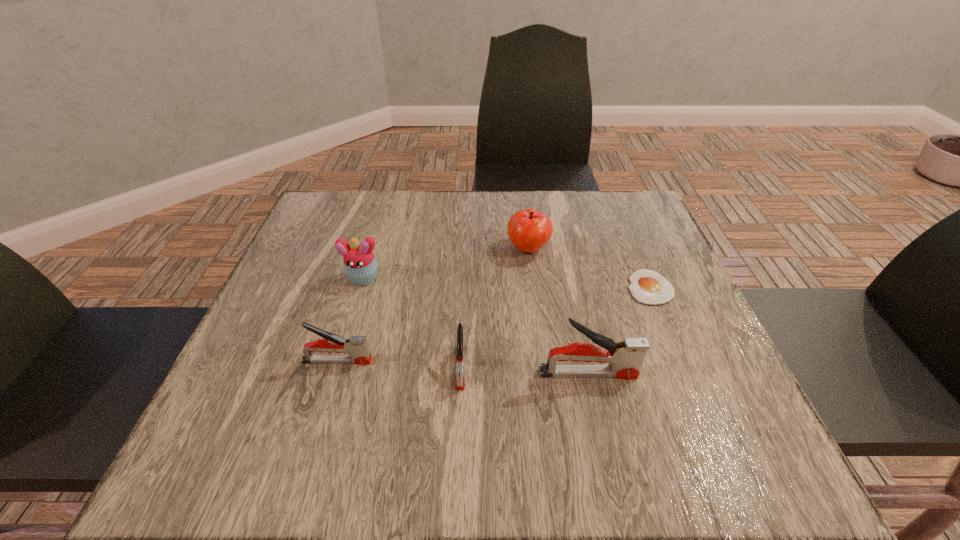
Where is `the leftmost stapler`? the leftmost stapler is located at coordinates pos(357,347).

Where is `the fourth object from right to left`? The image size is (960, 540). the fourth object from right to left is located at coordinates (460, 381).

Find the location of a particular element. the second stapler from right to left is located at coordinates pyautogui.click(x=460, y=381).

In order to click on the rightmost stapler in this screenshot , I will do `click(626, 356)`.

You are a GUI agent. You are given a task and a screenshot of the screen. Output one action in this format:
    pyautogui.click(x=<x>, y=<y>)
    Task: Click on the tallest stapler
    This screenshot has width=960, height=540.
    Given the screenshot: What is the action you would take?
    pyautogui.click(x=626, y=356)

At what (x,y) coordinates should I click in order to perform the action: click on apple. Please return your answer as a coordinate pair (x, y). Looking at the image, I should click on (529, 230).

This screenshot has width=960, height=540. I want to click on the rightmost object, so click(x=647, y=286).

The height and width of the screenshot is (540, 960). I want to click on the shortest object, so click(647, 286).

At what (x,y) coordinates should I click in order to perform the action: click on cupcake. Please return your answer as a coordinate pair (x, y). The image size is (960, 540). Looking at the image, I should click on (360, 266).

Identify the location of vacant area located on the handle side of the second shortest stapler. (522, 361).